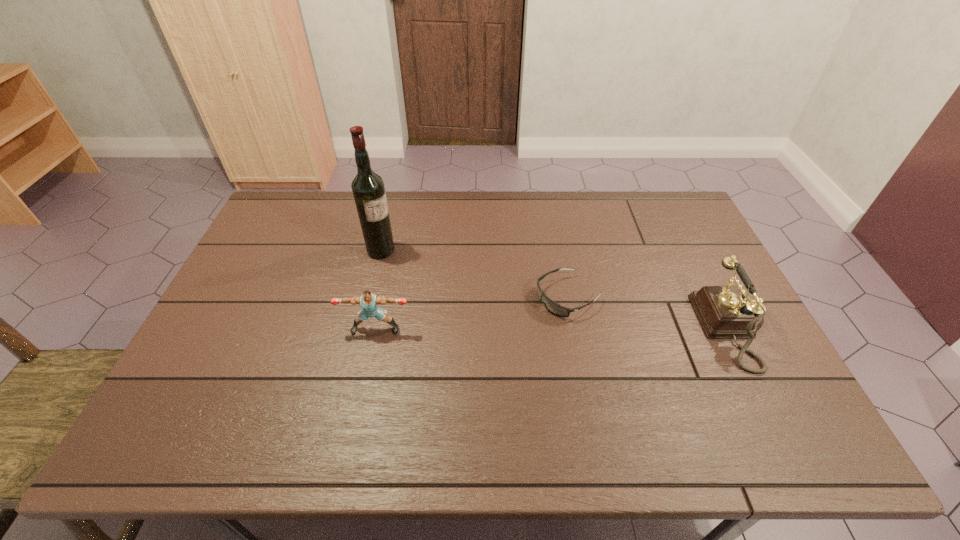
Locate an element on the screen. unoccupied position between the farthest object and the rightmost object is located at coordinates (559, 290).

This screenshot has height=540, width=960. Identify the location of empty location between the telephone and the goggles. (652, 313).

At what (x,y) coordinates should I click in order to perform the action: click on vacant point located between the farthest object and the puncher. Please return your answer as a coordinate pair (x, y). This screenshot has height=540, width=960. Looking at the image, I should click on click(x=378, y=290).

Identify the location of free space between the rightmost object and the wine bottle. The image size is (960, 540). (559, 290).

In order to click on free spot between the rightmost object and the tallest object in this screenshot , I will do `click(559, 290)`.

The image size is (960, 540). In order to click on vacant space that is in between the puncher and the farthest object in this screenshot , I will do `click(378, 290)`.

This screenshot has height=540, width=960. I want to click on free space between the puncher and the telephone, so click(556, 329).

Find the location of a particular element. free space between the telephone and the tallest object is located at coordinates (559, 290).

What are the coordinates of `object that can be found as the third closest to the rightmost object` in the screenshot? It's located at (368, 189).

Point out which object is positioned as the third nearest to the farthest object. Please provide its 2D coordinates. Your answer should be formatted as a tuple, i.e. [(x, y)], where the tuple contains the x and y coordinates of a point satisfying the conditions above.

[(725, 312)]